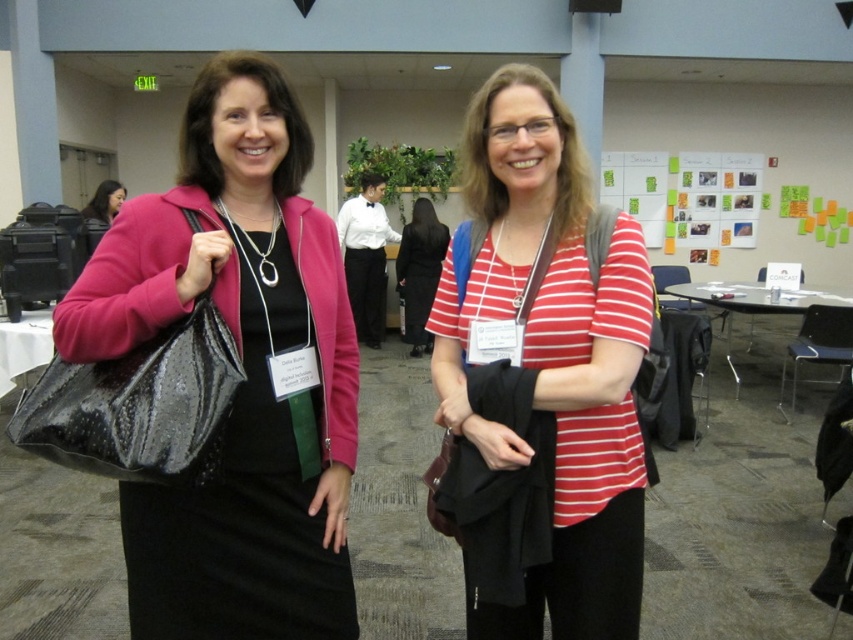
You are at a conference and need to determine which point is closer to you. You see two points marked in the image. The first point is at coordinates point (144,252) and the second is at point (436,284). Which point is closer to you?

Point (144,252) is closer to the viewer than point (436,284).

You are a photographer setting up for a group photo. You need to ensure that the shiny black bag at left and the black dress at center do not overlap in the frame. Based on their widths, which object should be positioned further back to prevent overlap?

The shiny black bag at left is wider than the black dress at center, so positioning the shiny black bag at left further back would help prevent overlap between the two objects.